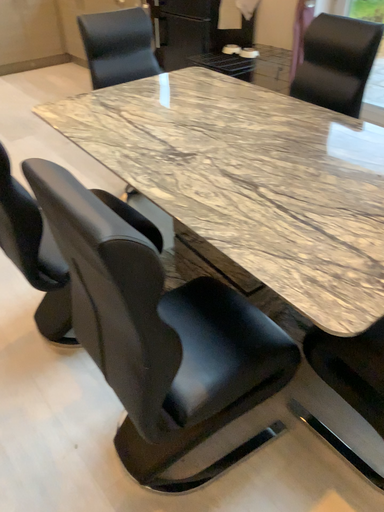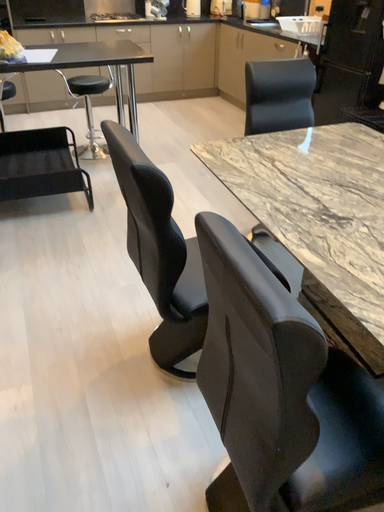
Question: Which way did the camera rotate in the video?

Choices:
 (A) rotated left
 (B) rotated right

Answer: (A)